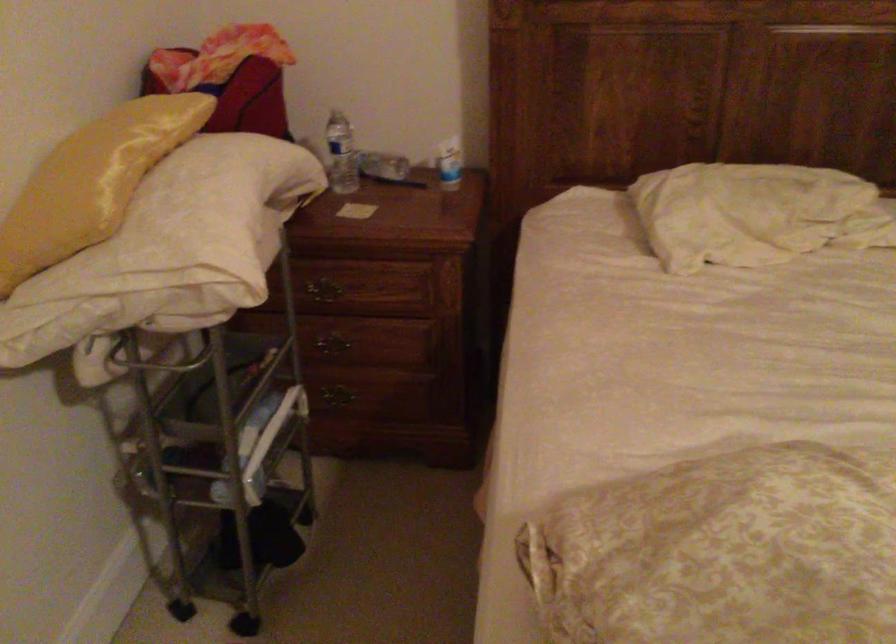
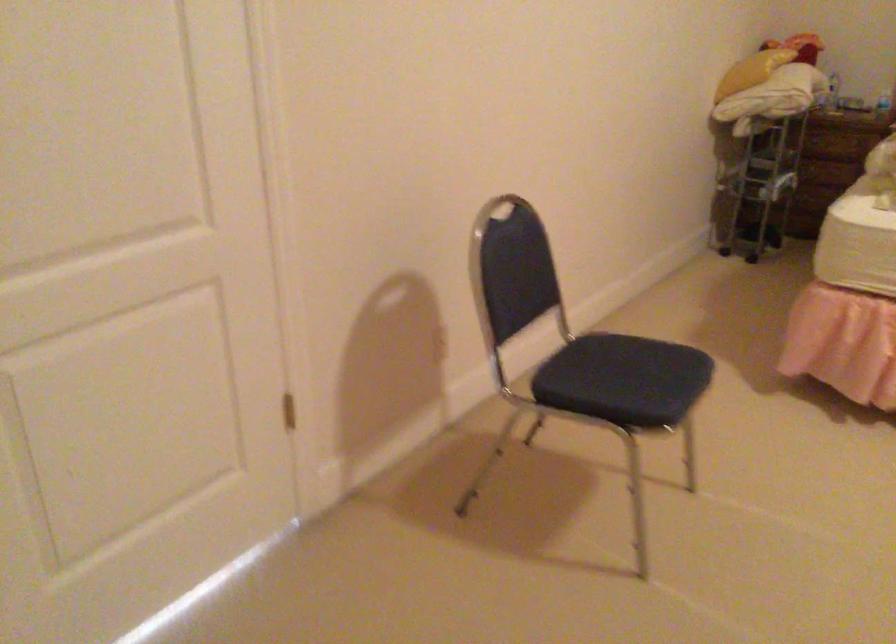
Question: Which direction would the cameraman need to move to produce the second image? Reply with the corresponding letter.

Choices:
 (A) Left
 (B) Right
 (C) Forward
 (D) Backward

Answer: (D)